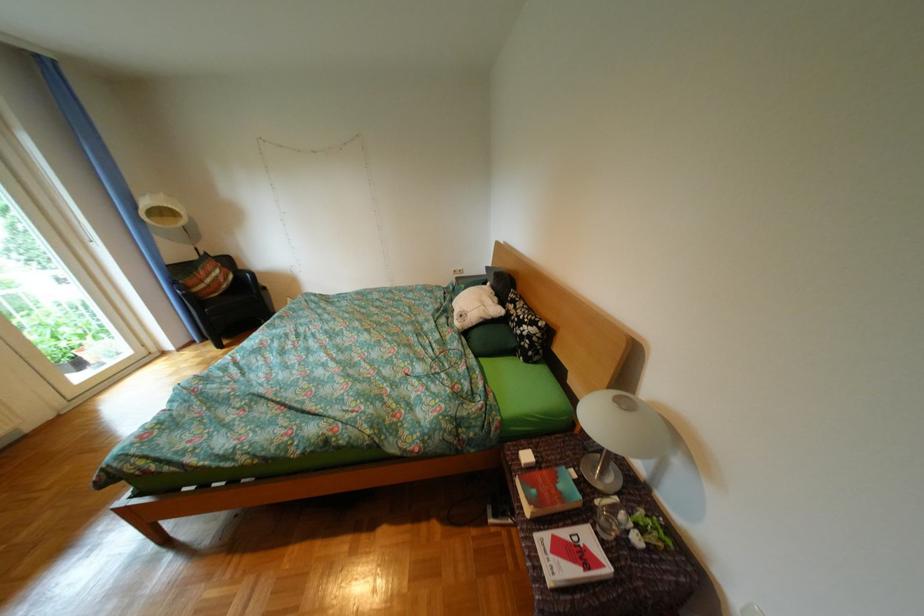
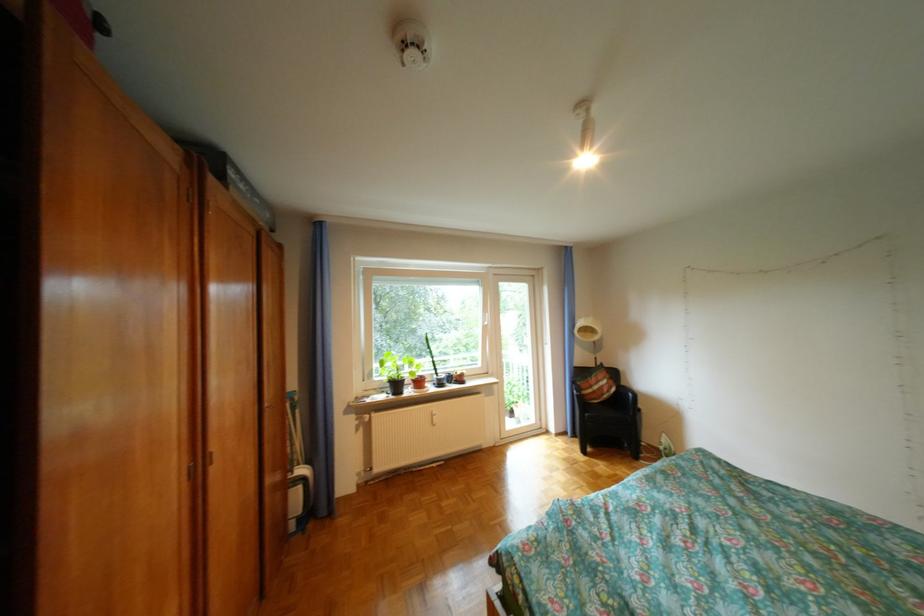
Question: Based on the continuous images, in which direction is the camera rotating? Reply with the corresponding letter.

Choices:
 (A) Left
 (B) Right
 (C) Up
 (D) Down

Answer: (A)